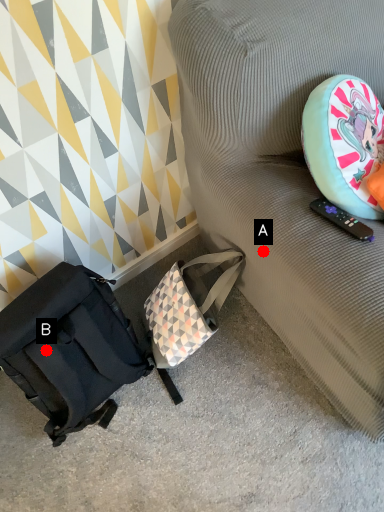
Question: Two points are circled on the image, labeled by A and B beside each circle. Which of the following is the farthest from the observer?

Choices:
 (A) A is further
 (B) B is further

Answer: (B)